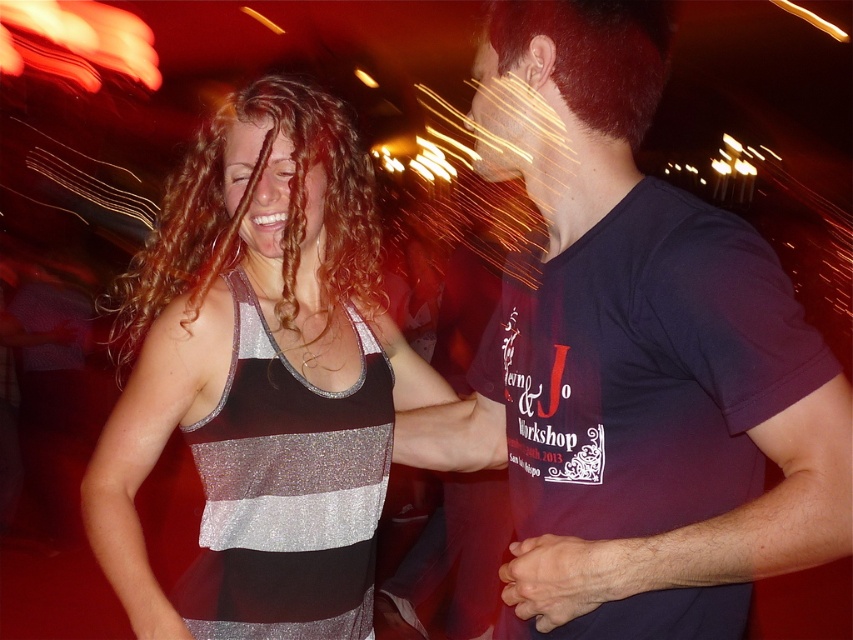
Based on the photo, which is above, shiny silver tank top at center or smooth skin hand at center?

shiny silver tank top at center

From the picture: Is shiny silver tank top at center shorter than smooth skin hand at center?

In fact, shiny silver tank top at center may be taller than smooth skin hand at center.

Which is behind, point (291, 614) or point (505, 595)?

Point (291, 614)

Find the location of a particular element. shiny silver tank top at center is located at coordinates (259, 378).

Who is lower down, shiny silver tank top at center or dark brown hair at upper right?

Positioned lower is shiny silver tank top at center.

Which of these two, shiny silver tank top at center or dark brown hair at upper right, stands shorter?

dark brown hair at upper right is shorter.

Measure the distance between shiny silver tank top at center and camera.

shiny silver tank top at center and camera are 1.16 meters apart.

You are a GUI agent. You are given a task and a screenshot of the screen. Output one action in this format:
    pyautogui.click(x=<x>, y=<y>)
    Task: Click on the shiny silver tank top at center
    
    Given the screenshot: What is the action you would take?
    pyautogui.click(x=259, y=378)

This screenshot has height=640, width=853. Describe the element at coordinates (642, 355) in the screenshot. I see `dark blue t-shirt at center` at that location.

Measure the distance between dark blue t-shirt at center and camera.

A distance of 31.57 inches exists between dark blue t-shirt at center and camera.

What are the coordinates of `dark blue t-shirt at center` in the screenshot? It's located at (642, 355).

Image resolution: width=853 pixels, height=640 pixels. Find the location of `dark blue t-shirt at center`. dark blue t-shirt at center is located at coordinates (642, 355).